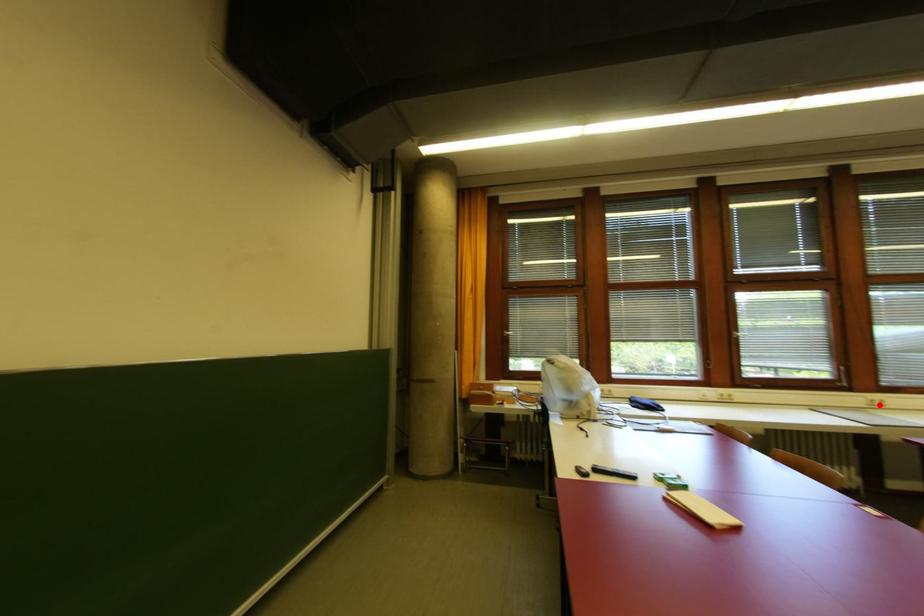
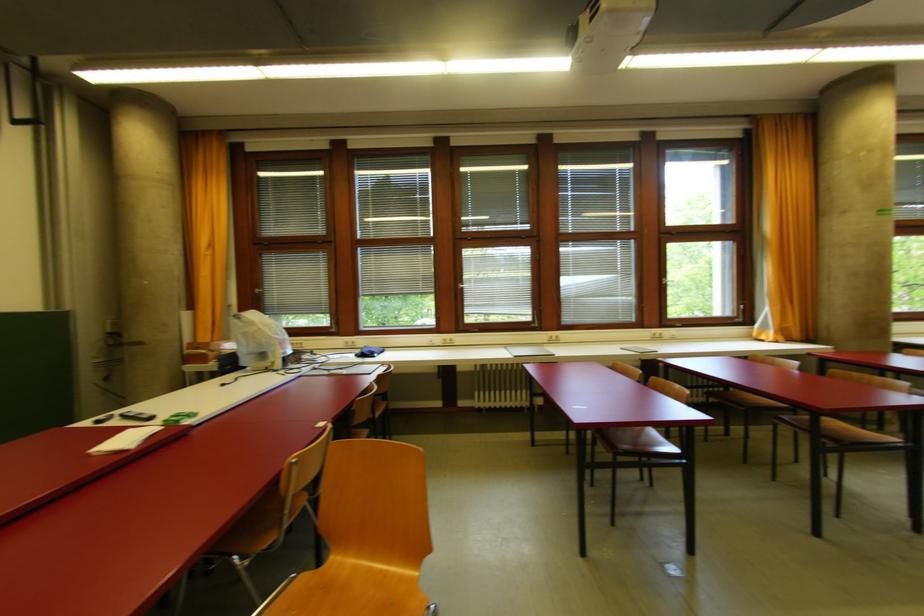
The point at the highlighted location is marked in the first image. Where is the corresponding point in the second image?

(556, 339)